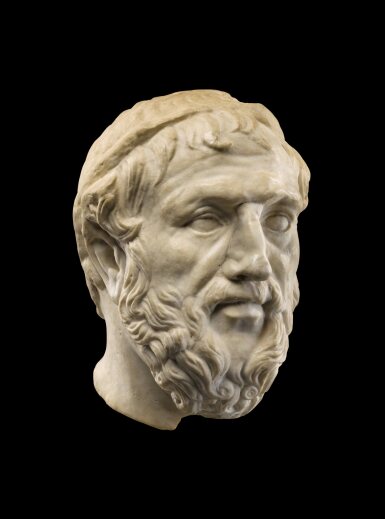
I want to click on bust, so click(x=249, y=177).